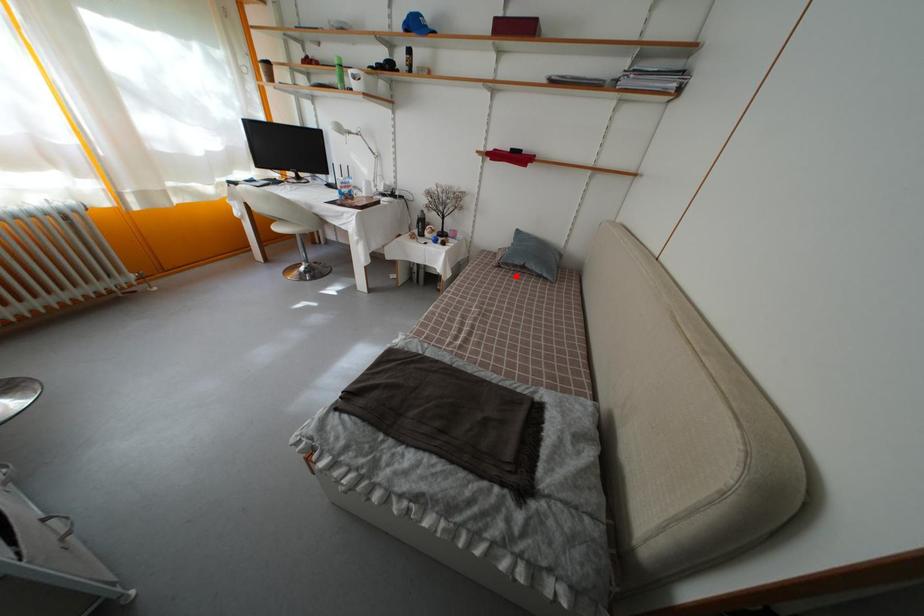
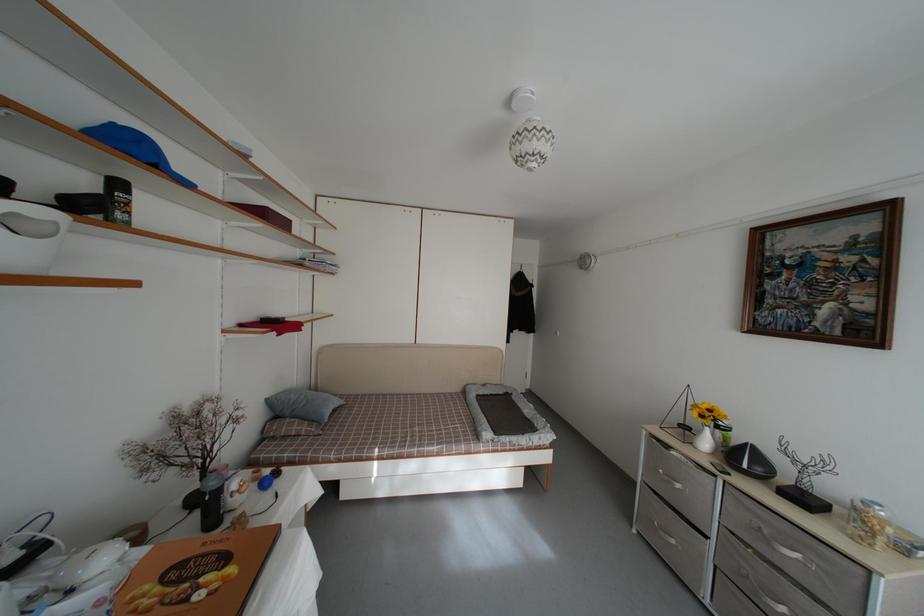
In the second image, find the point that corresponds to the highlighted location in the first image.

(332, 431)